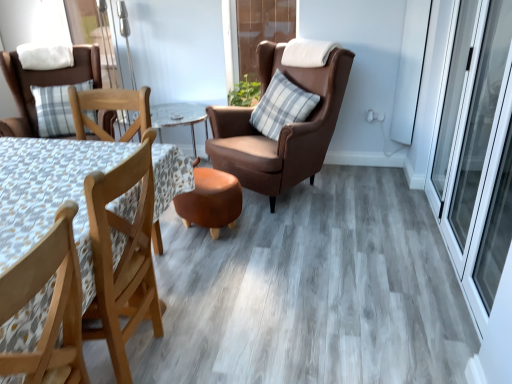
Question: Should I look upward or downward to see blue plaid pillow at center, arranged as the 2th pillow when viewed from the top?

Choices:
 (A) down
 (B) up

Answer: (B)

Question: Would you say wooden chair at lower left, the third chair viewed from the back, is a long distance from brown leather chair at center, positioned as the first chair in right-to-left order?

Choices:
 (A) yes
 (B) no

Answer: (A)

Question: From the image's perspective, is wooden chair at lower left, placed as the 2th chair when sorted from left to right, above brown leather chair at center, positioned as the first chair in right-to-left order?

Choices:
 (A) no
 (B) yes

Answer: (A)

Question: Is the depth of wooden chair at lower left, placed as the 2th chair when sorted from left to right, greater than that of brown leather chair at center, which ranks as the 2th chair in back-to-front order?

Choices:
 (A) yes
 (B) no

Answer: (B)

Question: Does wooden chair at lower left, marked as the 1th chair in a front-to-back arrangement, appear on the right side of brown leather chair at center, the 3th chair viewed from the left?

Choices:
 (A) no
 (B) yes

Answer: (A)

Question: Is wooden chair at lower left, marked as the 1th chair in a front-to-back arrangement, thinner than brown leather chair at center, which is the 2th chair in front-to-back order?

Choices:
 (A) yes
 (B) no

Answer: (A)

Question: From a real-world perspective, is wooden chair at lower left, the second chair from the right, under brown leather chair at center, which is the 2th chair in front-to-back order?

Choices:
 (A) no
 (B) yes

Answer: (A)

Question: From the image's perspective, is white soft pillow at upper left, which is the 1th pillow in top-to-bottom order, over matte brown chair at left, the 3th chair from the right?

Choices:
 (A) yes
 (B) no

Answer: (A)

Question: Is white soft pillow at upper left, positioned as the second pillow in bottom-to-top order, positioned beyond the bounds of matte brown chair at left, the first chair from the left?

Choices:
 (A) no
 (B) yes

Answer: (A)

Question: Is matte brown chair at left, the third chair when ordered from front to back, at the back of white soft pillow at upper left, marked as the 1th pillow in a left-to-right arrangement?

Choices:
 (A) no
 (B) yes

Answer: (B)

Question: Considering the relative sizes of white soft pillow at upper left, arranged as the 2th pillow when viewed from the right, and matte brown chair at left, the 3th chair from the right, in the image provided, is white soft pillow at upper left, arranged as the 2th pillow when viewed from the right, smaller than matte brown chair at left, the 3th chair from the right,?

Choices:
 (A) yes
 (B) no

Answer: (A)

Question: Does white soft pillow at upper left, positioned as the second pillow in bottom-to-top order, come behind matte brown chair at left, the 3th chair from the right?

Choices:
 (A) yes
 (B) no

Answer: (A)

Question: Is white soft pillow at upper left, arranged as the 2th pillow when viewed from the right, not close to matte brown chair at left, the first chair from the left?

Choices:
 (A) no
 (B) yes

Answer: (A)

Question: Can you confirm if matte brown chair at left, the 3th chair from the right, is bigger than wooden chair at lower left, placed as the 2th chair when sorted from left to right?

Choices:
 (A) yes
 (B) no

Answer: (A)